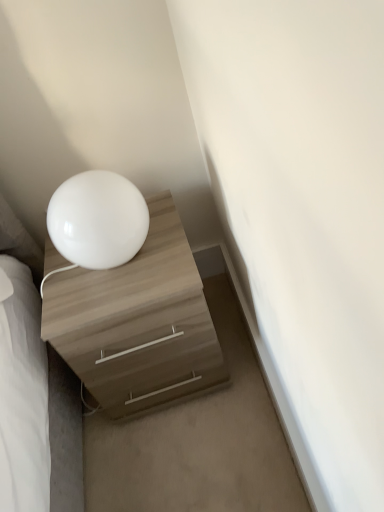
At what (x,y) coordinates should I click in order to perform the action: click on spots to the right of white glossy table lamp at upper left. Please return your answer as a coordinate pair (x, y). The width and height of the screenshot is (384, 512). Looking at the image, I should click on click(168, 238).